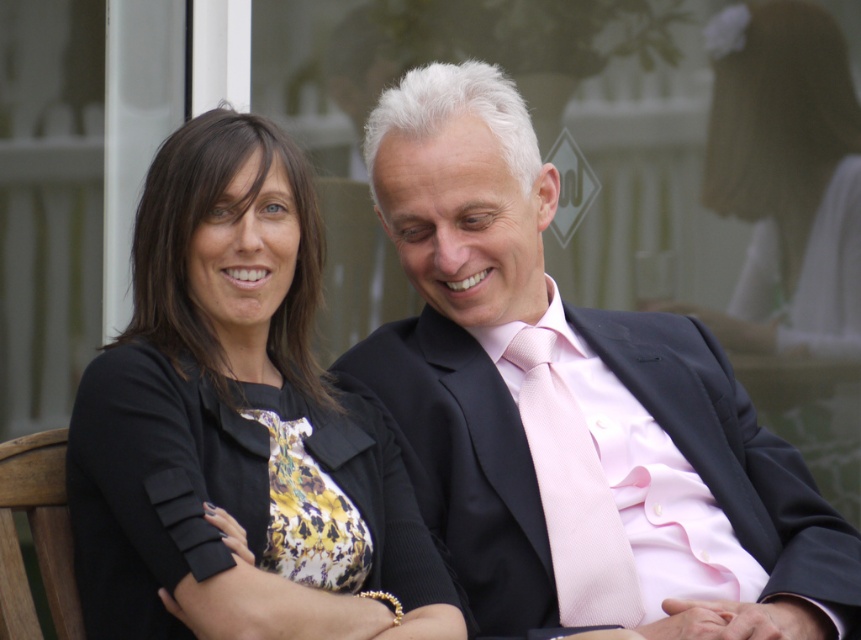
Based on the photo, between matte black suit at center and pink silk tie at center, which one appears on the left side from the viewer's perspective?

pink silk tie at center is more to the left.

Is point (533, 323) positioned behind point (542, 419)?

Yes, point (533, 323) is behind point (542, 419).

Between point (413, 113) and point (531, 458), which one is positioned in front?

Point (531, 458) is in front.

At what (x,y) coordinates should I click in order to perform the action: click on matte black suit at center. Please return your answer as a coordinate pair (x, y). Looking at the image, I should click on (573, 410).

Which is in front, point (128, 499) or point (797, 330)?

Point (128, 499) is more forward.

Who is lower down, black matte dress at left or matte black blazer at center?

Positioned lower is black matte dress at left.

Does point (276, 376) come in front of point (798, 380)?

Yes, point (276, 376) is in front of point (798, 380).

Where is `black matte dress at left`? This screenshot has width=861, height=640. black matte dress at left is located at coordinates (236, 420).

Which of these two, matte black blazer at center or pink silk tie at center, stands shorter?

pink silk tie at center

Between matte black blazer at center and pink silk tie at center, which one appears on the left side from the viewer's perspective?

pink silk tie at center is more to the left.

Where is `matte black blazer at center`? matte black blazer at center is located at coordinates (790, 225).

You are a GUI agent. You are given a task and a screenshot of the screen. Output one action in this format:
    pyautogui.click(x=<x>, y=<y>)
    Task: Click on the matte black blazer at center
    Image resolution: width=861 pixels, height=640 pixels.
    Given the screenshot: What is the action you would take?
    [790, 225]